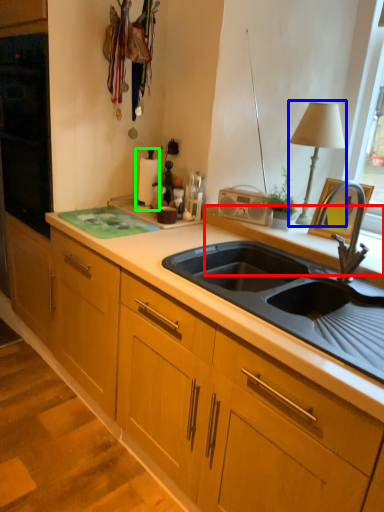
Question: Based on their relative distances, which object is farther from window sill (highlighted by a red box)? Choose from table lamp (highlighted by a blue box) and appliance (highlighted by a green box).

Choices:
 (A) table lamp
 (B) appliance

Answer: (B)